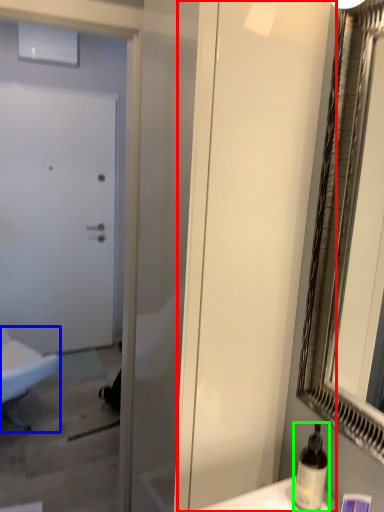
Question: Estimate the real-world distances between objects in this image. Which object is farther from screen door (highlighted by a red box), furniture (highlighted by a blue box) or bottle (highlighted by a green box)?

Choices:
 (A) furniture
 (B) bottle

Answer: (A)